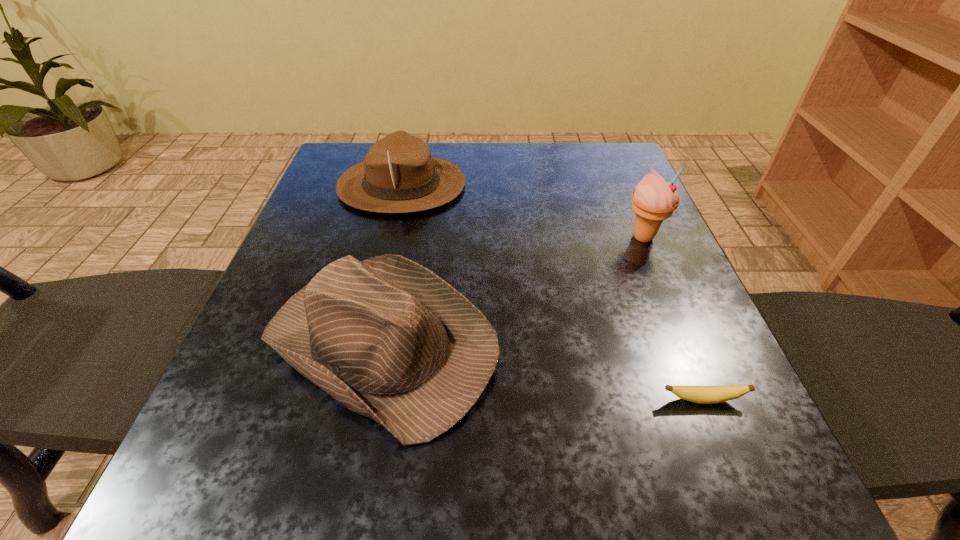
Where is `empty space between the icecream and the nearer fedora`? This screenshot has width=960, height=540. empty space between the icecream and the nearer fedora is located at coordinates (513, 290).

In order to click on free space that is in between the shortest object and the nearer fedora in this screenshot , I will do `click(542, 371)`.

This screenshot has height=540, width=960. I want to click on vacant space in between the banana and the nearer fedora, so click(542, 371).

Find the location of `blank region between the banana and the nearer fedora`. blank region between the banana and the nearer fedora is located at coordinates (542, 371).

I want to click on vacant space that is in between the third nearest object and the nearer fedora, so 513,290.

You are a GUI agent. You are given a task and a screenshot of the screen. Output one action in this format:
    pyautogui.click(x=<x>, y=<y>)
    Task: Click on the free space between the icecream and the farthest object
    
    Given the screenshot: What is the action you would take?
    pyautogui.click(x=522, y=211)

Locate an element on the screen. vacant area that lies between the nearer fedora and the third nearest object is located at coordinates 513,290.

The image size is (960, 540). I want to click on empty location between the nearer fedora and the shortest object, so click(542, 371).

Locate an element on the screen. empty space that is in between the second farthest object and the farthest object is located at coordinates (522, 211).

In order to click on object that ranks as the third closest to the nearer fedora in this screenshot , I will do `click(654, 200)`.